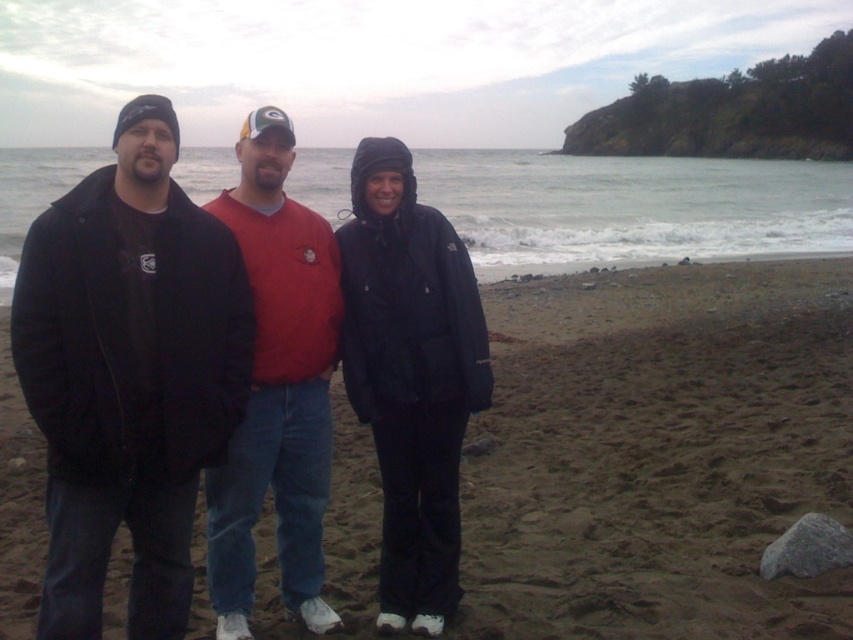
Question: Which point is closer to the camera?

Choices:
 (A) (448, 492)
 (B) (268, 628)
 (C) (341, 314)
 (D) (227, 268)

Answer: (D)

Question: Among these points, which one is farthest from the camera?

Choices:
 (A) (323, 616)
 (B) (677, 624)

Answer: (A)

Question: Does brown sandy beach at center have a lesser width compared to matte black jacket at left?

Choices:
 (A) no
 (B) yes

Answer: (A)

Question: Can you confirm if matte black jacket at left is thinner than matte black jacket at center?

Choices:
 (A) yes
 (B) no

Answer: (A)

Question: Does matte black jacket at center have a greater width compared to matte red sweater at center?

Choices:
 (A) no
 (B) yes

Answer: (A)

Question: Which object appears closest to the camera in this image?

Choices:
 (A) matte red sweater at center
 (B) brown sandy beach at center

Answer: (A)